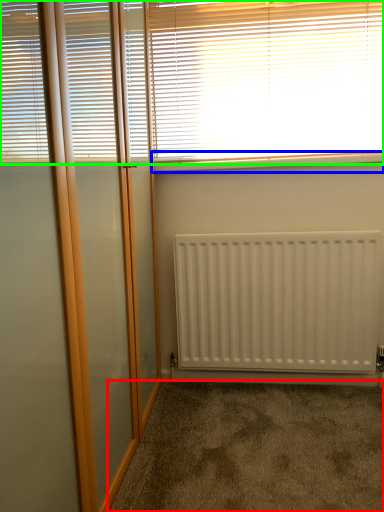
Question: Which object is the farthest from corridor (highlighted by a red box)? Choose among these: window sill (highlighted by a blue box) or window blind (highlighted by a green box).

Choices:
 (A) window sill
 (B) window blind

Answer: (B)